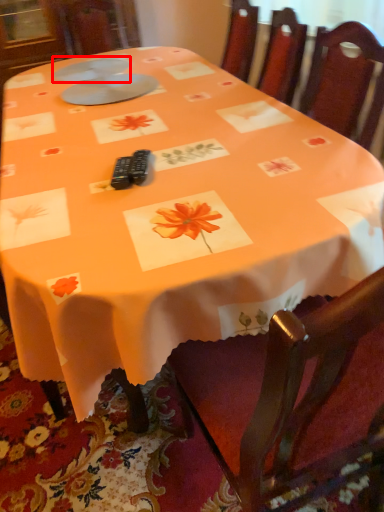
Question: In this image, where is tableware (annotated by the red box) located relative to tableware?

Choices:
 (A) right
 (B) left

Answer: (B)